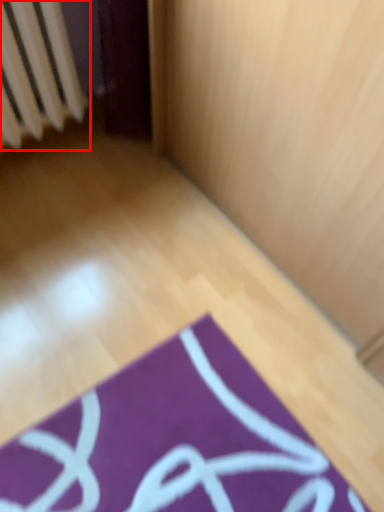
Question: From the image's perspective, where is radiator (annotated by the red box) located relative to yoga mat?

Choices:
 (A) above
 (B) below

Answer: (A)